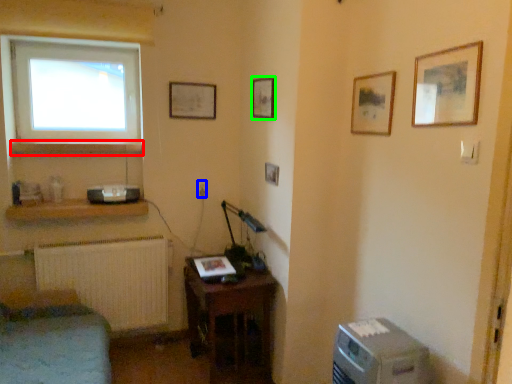
Question: Considering the real-world distances, which object is closest to shelf (highlighted by a red box)? electric outlet (highlighted by a blue box) or picture frame (highlighted by a green box).

Choices:
 (A) electric outlet
 (B) picture frame

Answer: (A)